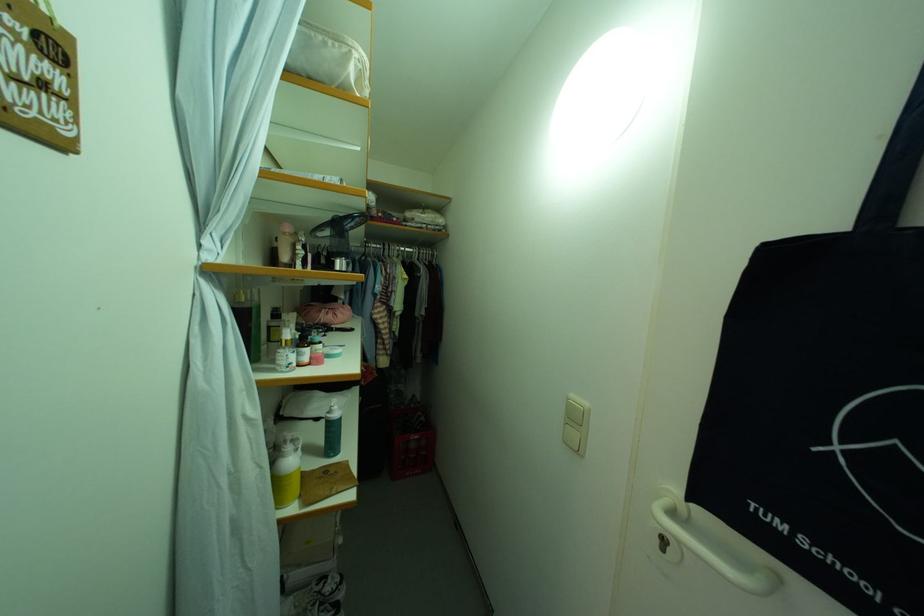
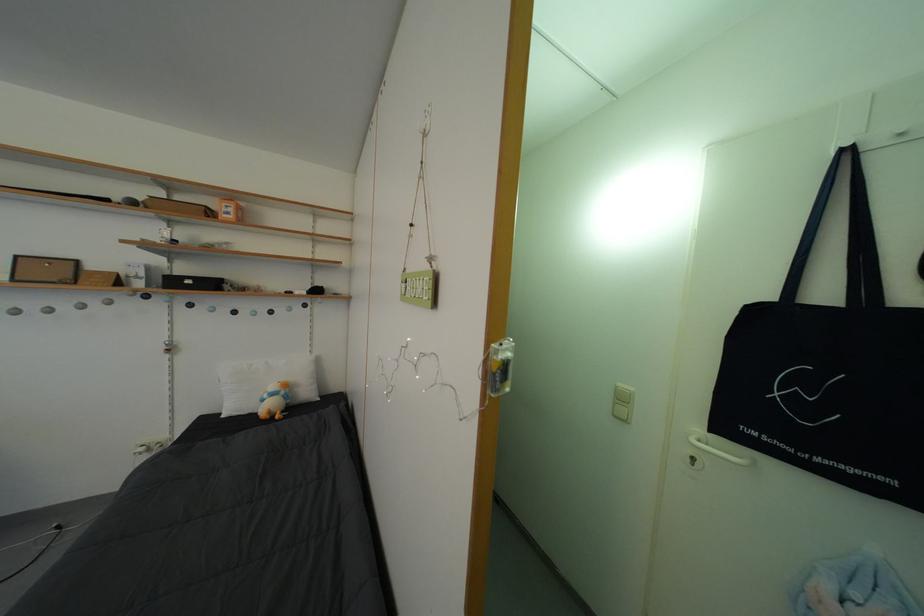
Question: Based on the continuous images, in which direction is the camera rotating? Reply with the corresponding letter.

Choices:
 (A) Left
 (B) Right
 (C) Up
 (D) Down

Answer: (B)